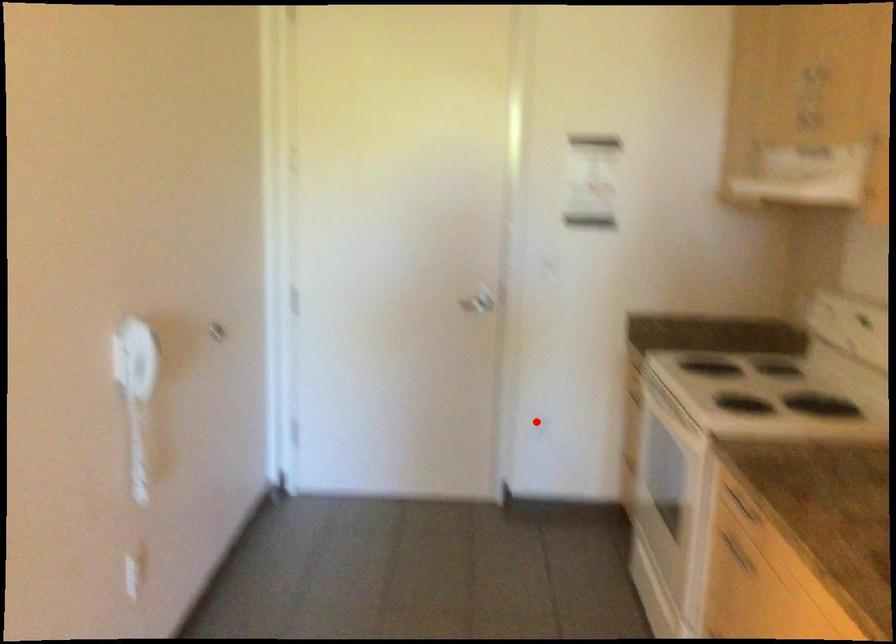
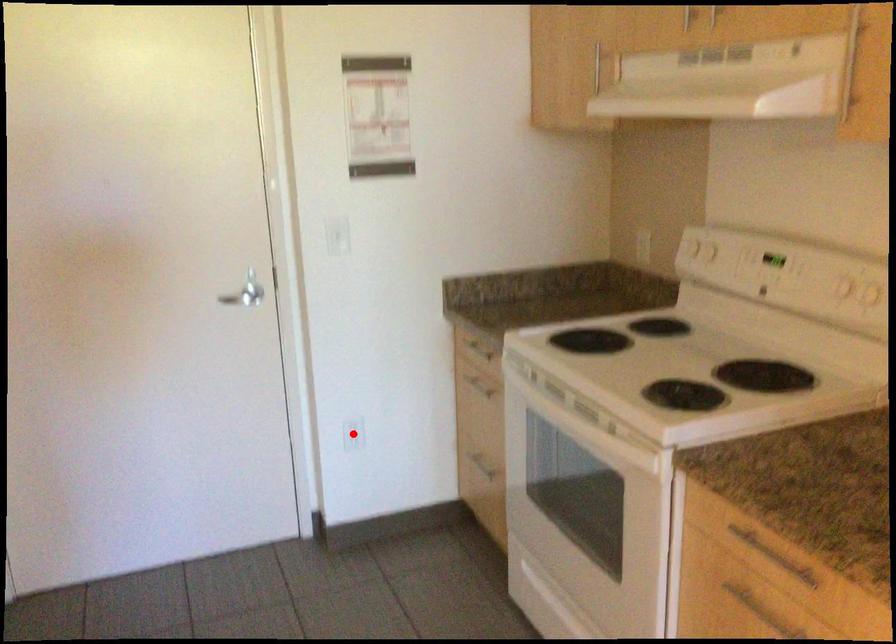
I am providing you with two images of the same scene from different viewpoints. A red point is marked on the first image and another point is marked on the second image. Is the marked point in image1 the same physical position as the marked point in image2?

Yes